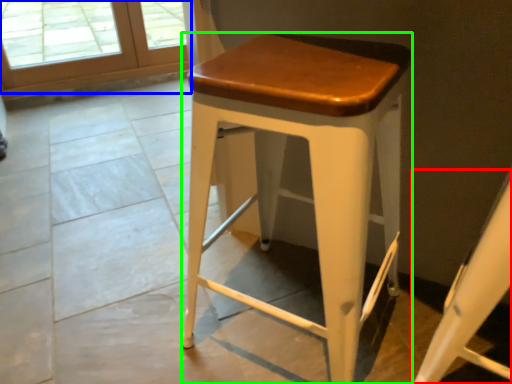
Question: Which object is the farthest from swivel chair (highlighted by a red box)? Choose among these: screen door (highlighted by a blue box) or stool (highlighted by a green box).

Choices:
 (A) screen door
 (B) stool

Answer: (A)